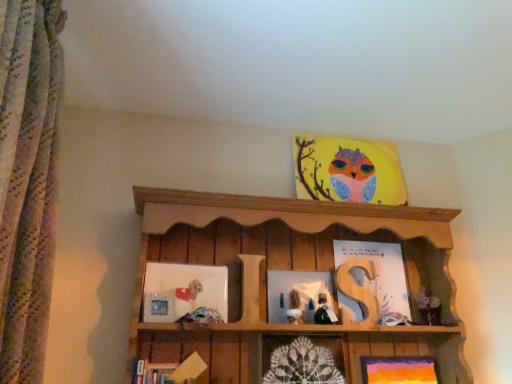
Question: Is there a large distance between green glass bottle at center, arranged as the 2th toy when viewed from the left, and matte silver picture frame at lower left, which is counted as the fourth picture frame, starting from the bottom?

Choices:
 (A) yes
 (B) no

Answer: (B)

Question: Is green glass bottle at center, arranged as the 2th toy when viewed from the left, facing towards matte silver picture frame at lower left, positioned as the third picture frame in top-to-bottom order?

Choices:
 (A) no
 (B) yes

Answer: (A)

Question: Considering the relative sizes of green glass bottle at center, the first toy viewed from the right, and matte silver picture frame at lower left, positioned as the third picture frame in top-to-bottom order, in the image provided, is green glass bottle at center, the first toy viewed from the right, thinner than matte silver picture frame at lower left, positioned as the third picture frame in top-to-bottom order,?

Choices:
 (A) yes
 (B) no

Answer: (B)

Question: Considering the relative sizes of green glass bottle at center, arranged as the 2th toy when viewed from the left, and matte silver picture frame at lower left, which is counted as the fourth picture frame, starting from the bottom, in the image provided, is green glass bottle at center, arranged as the 2th toy when viewed from the left, wider than matte silver picture frame at lower left, which is counted as the fourth picture frame, starting from the bottom,?

Choices:
 (A) no
 (B) yes

Answer: (B)

Question: Does green glass bottle at center, the first toy viewed from the right, appear on the right side of matte silver picture frame at lower left, which is counted as the fourth picture frame, starting from the bottom?

Choices:
 (A) no
 (B) yes

Answer: (B)

Question: From the image's perspective, is matte paper owl at upper center, the sixth picture frame positioned from the bottom, positioned above or below white fabric doll at center, the first toy when ordered from left to right?

Choices:
 (A) above
 (B) below

Answer: (A)

Question: Is matte paper owl at upper center, the sixth picture frame positioned from the bottom, inside or outside of white fabric doll at center, placed as the second toy when sorted from right to left?

Choices:
 (A) inside
 (B) outside

Answer: (B)

Question: Is matte paper owl at upper center, the sixth picture frame positioned from the bottom, in front of or behind white fabric doll at center, the first toy when ordered from left to right, in the image?

Choices:
 (A) front
 (B) behind

Answer: (B)

Question: Does point (307, 165) appear closer or farther from the camera than point (300, 319)?

Choices:
 (A) farther
 (B) closer

Answer: (A)

Question: Based on their positions, is matte white picture frame at left, marked as the fifth picture frame in a bottom-to-top arrangement, located to the left or right of wooden shelf at upper center?

Choices:
 (A) left
 (B) right

Answer: (A)

Question: Considering the positions of matte white picture frame at left, marked as the fifth picture frame in a bottom-to-top arrangement, and wooden shelf at upper center in the image, is matte white picture frame at left, marked as the fifth picture frame in a bottom-to-top arrangement, wider or thinner than wooden shelf at upper center?

Choices:
 (A) thin
 (B) wide

Answer: (A)

Question: Does point (155, 269) appear closer or farther from the camera than point (129, 360)?

Choices:
 (A) farther
 (B) closer

Answer: (A)

Question: Considering their positions, is matte white picture frame at left, marked as the fifth picture frame in a bottom-to-top arrangement, located in front of or behind wooden shelf at upper center?

Choices:
 (A) front
 (B) behind

Answer: (B)

Question: Is point (270, 309) positioned closer to the camera than point (212, 271)?

Choices:
 (A) farther
 (B) closer

Answer: (A)

Question: From a real-world perspective, relative to matte white picture frame at left, marked as the fifth picture frame in a bottom-to-top arrangement, is matte glass picture frame at center, the 3th picture frame positioned from the bottom, vertically above or below?

Choices:
 (A) below
 (B) above

Answer: (A)